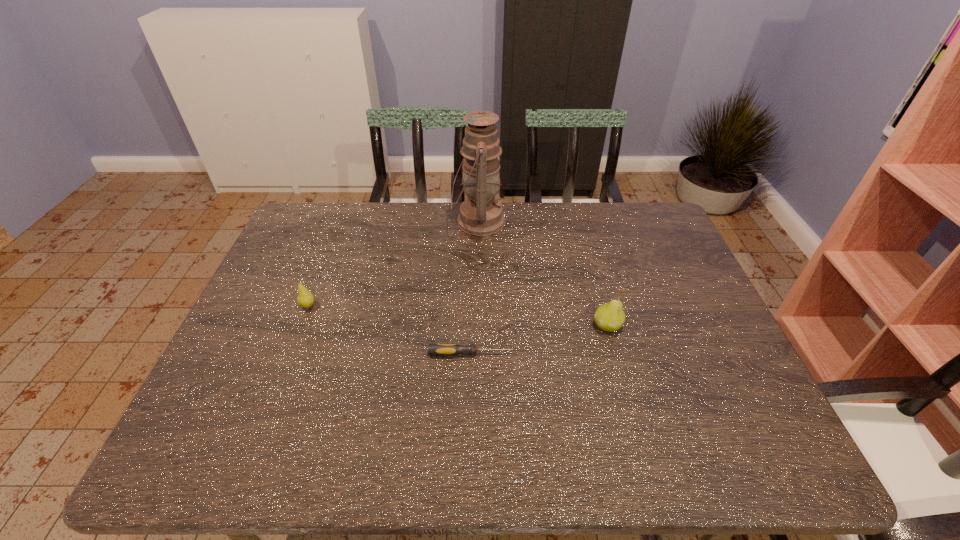
You are a GUI agent. You are given a task and a screenshot of the screen. Output one action in this format:
    pyautogui.click(x=<x>, y=<y>)
    Task: Click on the vacant area situated on the front of the leftmost object
    
    Given the screenshot: What is the action you would take?
    pyautogui.click(x=300, y=326)

Identify the location of vacant space located 0.150m insert the shortest object into a screw head. (575, 354).

Where is `object situated at the far edge`? The image size is (960, 540). object situated at the far edge is located at coordinates [481, 214].

Locate an element on the screen. This screenshot has width=960, height=540. object located at the left edge is located at coordinates (305, 299).

In the image, there is a desktop. Where is `blank space at the far edge`? blank space at the far edge is located at coordinates (395, 225).

Locate an element on the screen. This screenshot has width=960, height=540. vacant position at the near edge of the desktop is located at coordinates (413, 447).

I want to click on free location at the left edge, so click(x=312, y=272).

Identify the location of vacant space at the right edge of the desktop. (710, 356).

In the image, there is a desktop. Identify the location of vacant space at the far right corner. This screenshot has width=960, height=540. (656, 213).

The image size is (960, 540). I want to click on free space at the near right corner, so pos(712,429).